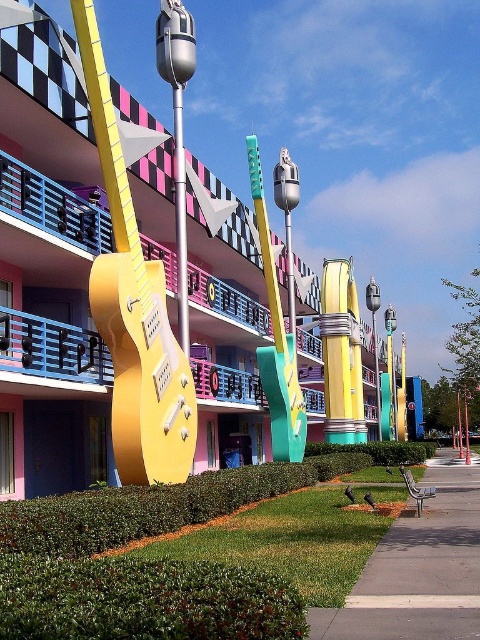
Question: Does yellow matte guitar at center have a smaller size compared to metallic pole at center?

Choices:
 (A) yes
 (B) no

Answer: (B)

Question: Which point is farther to the camera?

Choices:
 (A) (272, 403)
 (B) (403, 588)

Answer: (A)

Question: Does yellow matte guitar at center have a lesser width compared to teal glossy guitar at center?

Choices:
 (A) yes
 (B) no

Answer: (B)

Question: Estimate the real-world distances between objects in this image. Which object is closer to the yellow matte guitar at center?

Choices:
 (A) gray concrete sidewalk at lower right
 (B) gold metallic guitar at center
 (C) metallic pole at center
 (D) teal glossy guitar at center

Answer: (D)

Question: Is gray concrete sidewalk at lower right wider than teal glossy guitar at center?

Choices:
 (A) yes
 (B) no

Answer: (A)

Question: Which of the following is the farthest from the observer?

Choices:
 (A) (444, 468)
 (B) (124, 317)
 (C) (180, 337)
 (D) (302, 406)

Answer: (A)